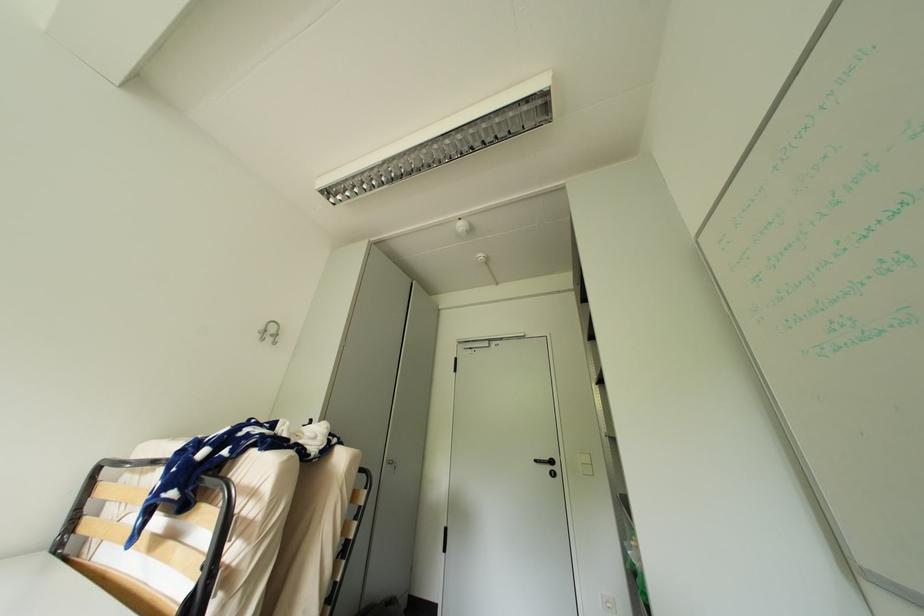
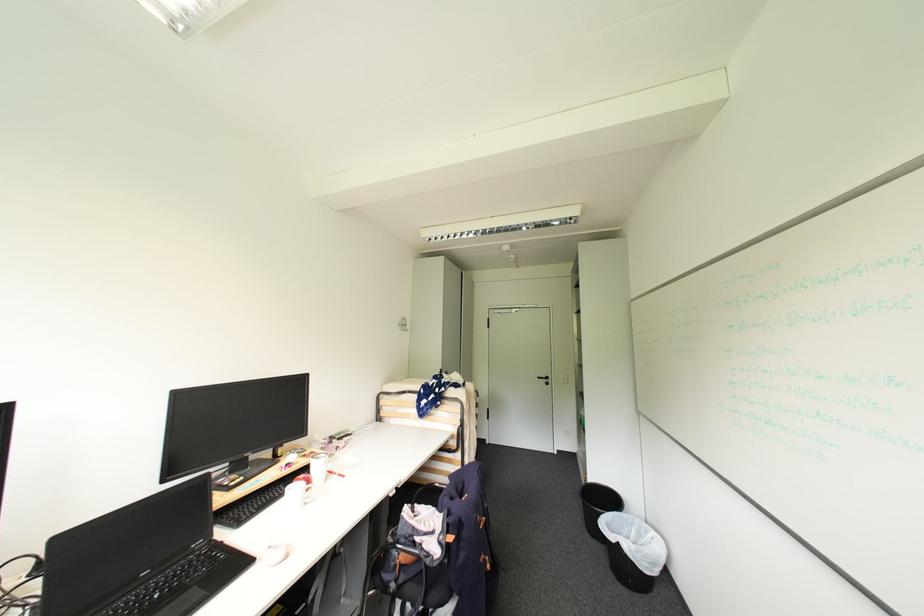
Locate, in the second image, the point that corresponds to (x=542, y=462) in the first image.

(544, 379)